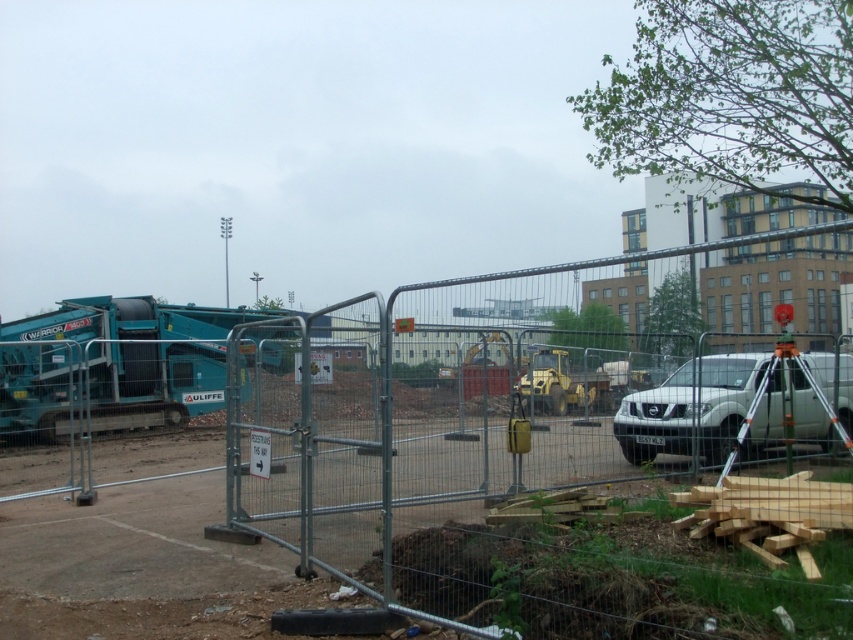
Question: Does metal fence at center appear on the right side of white matte suv at center?

Choices:
 (A) yes
 (B) no

Answer: (B)

Question: Is metal fence at center below white matte suv at center?

Choices:
 (A) yes
 (B) no

Answer: (A)

Question: Does metal fence at center have a smaller size compared to white matte suv at center?

Choices:
 (A) no
 (B) yes

Answer: (A)

Question: Which of these objects is positioned farthest from the metal fence at center?

Choices:
 (A) teal metallic/industrial at left
 (B) white matte suv at center

Answer: (A)

Question: Estimate the real-world distances between objects in this image. Which object is farther from the teal metallic/industrial at left?

Choices:
 (A) white matte suv at center
 (B) metal fence at center

Answer: (A)

Question: Which of the following is the closest to the observer?

Choices:
 (A) metal fence at center
 (B) white matte suv at center

Answer: (A)